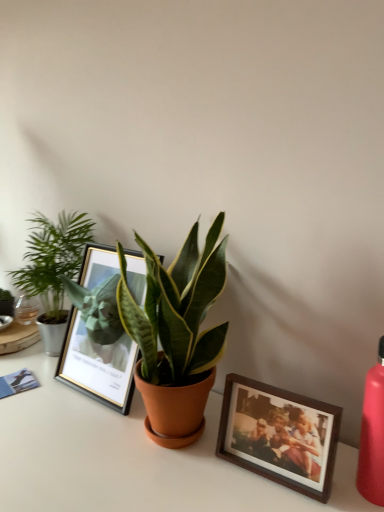
Question: Is wooden photo frame at lower right, the second picture frame when ordered from back to front, smaller than green glossy houseplant at center, which is the 1th houseplant from front to back?

Choices:
 (A) no
 (B) yes

Answer: (B)

Question: Is wooden photo frame at lower right, positioned as the 2th picture frame in left-to-right order, at the left side of green glossy houseplant at center, which appears as the 2th houseplant when viewed from the back?

Choices:
 (A) yes
 (B) no

Answer: (B)

Question: From a real-world perspective, is wooden photo frame at lower right, the second picture frame when ordered from back to front, physically above green glossy houseplant at center, which appears as the 2th houseplant when viewed from the back?

Choices:
 (A) yes
 (B) no

Answer: (B)

Question: From a real-world perspective, is wooden photo frame at lower right, positioned as the 2th picture frame in left-to-right order, under green glossy houseplant at center, which is the 1th houseplant from front to back?

Choices:
 (A) no
 (B) yes

Answer: (B)

Question: Could green glossy houseplant at center, positioned as the 1th houseplant in right-to-left order, be considered to be inside wooden photo frame at lower right, positioned as the 2th picture frame in left-to-right order?

Choices:
 (A) yes
 (B) no

Answer: (B)

Question: From a real-world perspective, is wooden photo frame at lower right, acting as the 1th picture frame starting from the front, above or below white glossy table at center?

Choices:
 (A) above
 (B) below

Answer: (A)

Question: Is wooden photo frame at lower right, acting as the 1th picture frame starting from the front, taller or shorter than white glossy table at center?

Choices:
 (A) tall
 (B) short

Answer: (B)

Question: Considering the positions of wooden photo frame at lower right, the first picture frame viewed from the right, and white glossy table at center in the image, is wooden photo frame at lower right, the first picture frame viewed from the right, wider or thinner than white glossy table at center?

Choices:
 (A) wide
 (B) thin

Answer: (B)

Question: Considering the positions of wooden photo frame at lower right, the first picture frame viewed from the right, and white glossy table at center in the image, is wooden photo frame at lower right, the first picture frame viewed from the right, bigger or smaller than white glossy table at center?

Choices:
 (A) big
 (B) small

Answer: (B)

Question: Is wooden photo frame at lower right, the first picture frame viewed from the right, taller or shorter than green leafy plant at left, the second houseplant when ordered from front to back?

Choices:
 (A) short
 (B) tall

Answer: (A)

Question: From a real-world perspective, relative to green leafy plant at left, which ranks as the 1th houseplant in left-to-right order, is wooden photo frame at lower right, the first picture frame viewed from the right, vertically above or below?

Choices:
 (A) above
 (B) below

Answer: (B)

Question: Is wooden photo frame at lower right, the second picture frame when ordered from back to front, in front of or behind green leafy plant at left, the second houseplant when ordered from front to back, in the image?

Choices:
 (A) front
 (B) behind

Answer: (A)

Question: In the image, is wooden photo frame at lower right, positioned as the 2th picture frame in left-to-right order, on the left side or the right side of green leafy plant at left, which ranks as the 1th houseplant in left-to-right order?

Choices:
 (A) left
 (B) right

Answer: (B)

Question: From the image's perspective, is green glossy houseplant at center, which appears as the 2th houseplant when viewed from the back, positioned above or below green leafy plant at left, which ranks as the 1th houseplant in left-to-right order?

Choices:
 (A) below
 (B) above

Answer: (A)

Question: Which is correct: green glossy houseplant at center, which ranks as the second houseplant in left-to-right order, is inside green leafy plant at left, which ranks as the 1th houseplant in left-to-right order, or outside of it?

Choices:
 (A) inside
 (B) outside

Answer: (B)